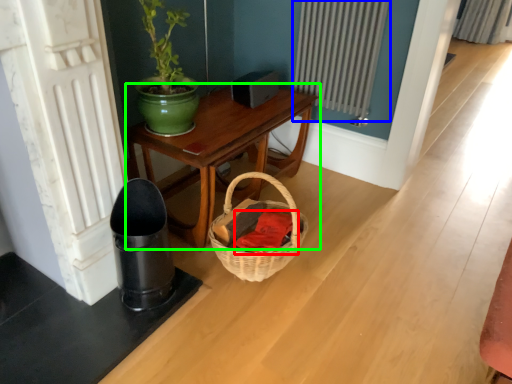
Question: Based on their relative distances, which object is farther from clothing (highlighted by a red box)? Choose from radiator (highlighted by a blue box) and table (highlighted by a green box).

Choices:
 (A) radiator
 (B) table

Answer: (A)